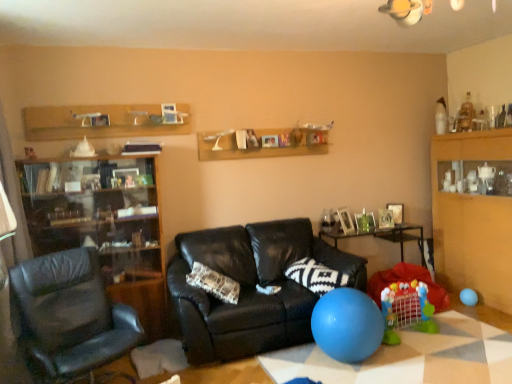
In order to click on vacant space in front of plastic colorful playpen at lower right in this screenshot , I will do `click(431, 351)`.